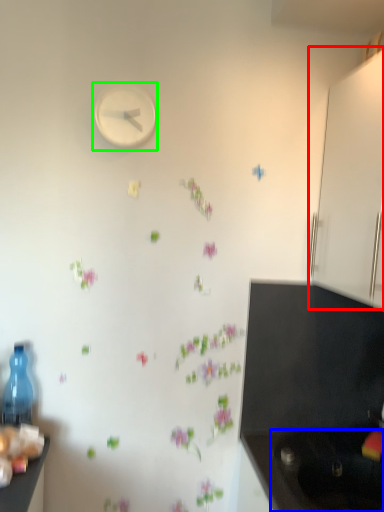
Question: Which object is the farthest from cabinetry (highlighted by a red box)? Choose among these: sink (highlighted by a blue box) or clock (highlighted by a green box).

Choices:
 (A) sink
 (B) clock

Answer: (A)